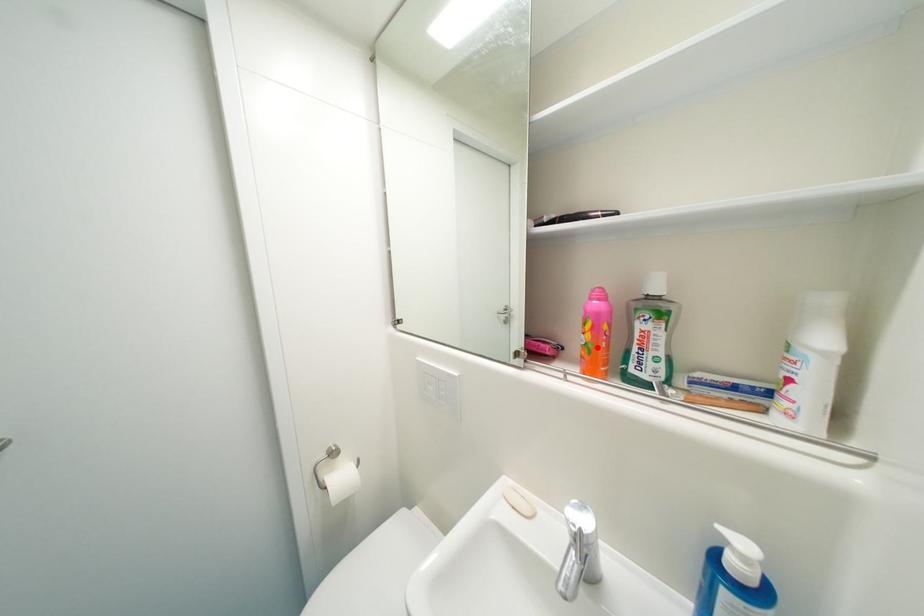
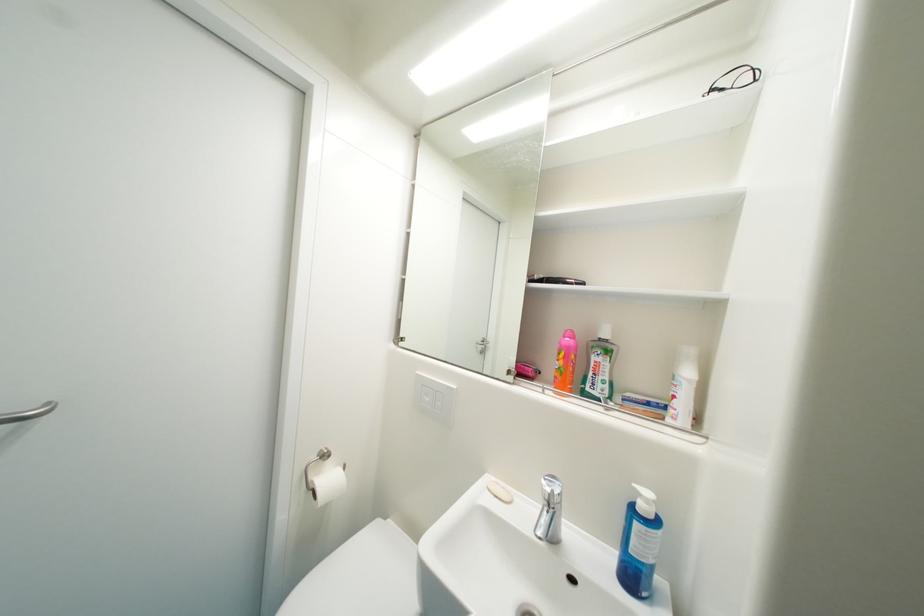
Find the pixel in the second image that matches the highlighted location in the first image.

(569, 371)